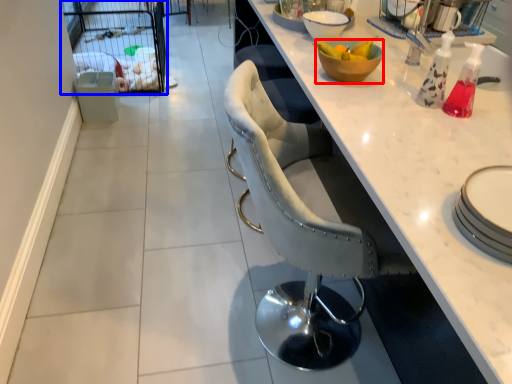
Question: Which object is closer to the camera taking this photo, bowl (highlighted by a red box) or screen door (highlighted by a blue box)?

Choices:
 (A) bowl
 (B) screen door

Answer: (A)